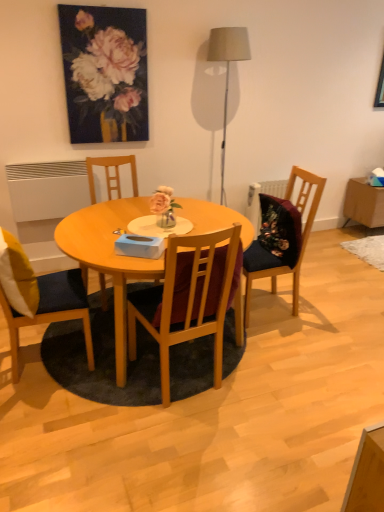
This screenshot has width=384, height=512. What are the coordinates of `vacant area located to the right-hand side of light brown wooden table at center` in the screenshot? It's located at (325, 343).